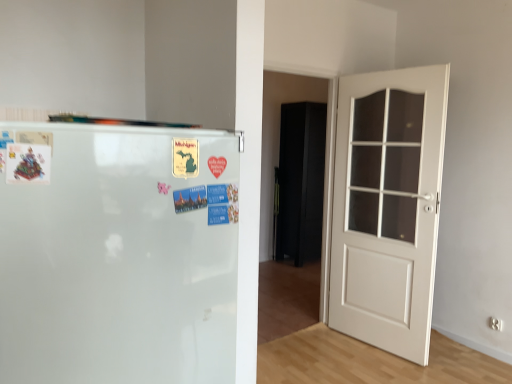
Question: Is the depth of white glossy refrigerator at left greater than that of white wooden door at right?

Choices:
 (A) yes
 (B) no

Answer: (B)

Question: Is white glossy refrigerator at left at the left side of white wooden door at right?

Choices:
 (A) no
 (B) yes

Answer: (B)

Question: From a real-world perspective, is white glossy refrigerator at left located higher than white wooden door at right?

Choices:
 (A) no
 (B) yes

Answer: (B)

Question: Does white glossy refrigerator at left come in front of white wooden door at right?

Choices:
 (A) yes
 (B) no

Answer: (A)

Question: Is white glossy refrigerator at left oriented towards white wooden door at right?

Choices:
 (A) yes
 (B) no

Answer: (B)

Question: Does point (409, 228) appear closer or farther from the camera than point (436, 74)?

Choices:
 (A) closer
 (B) farther

Answer: (B)

Question: From a real-world perspective, is clear glass door at right positioned above or below white wooden door at right?

Choices:
 (A) above
 (B) below

Answer: (A)

Question: Is clear glass door at right in front of or behind white wooden door at right in the image?

Choices:
 (A) behind
 (B) front

Answer: (A)

Question: In terms of height, does clear glass door at right look taller or shorter compared to white wooden door at right?

Choices:
 (A) tall
 (B) short

Answer: (B)

Question: From the image's perspective, relative to white wooden door at right, is white glossy refrigerator at left above or below?

Choices:
 (A) above
 (B) below

Answer: (B)

Question: In terms of width, does white glossy refrigerator at left look wider or thinner when compared to white wooden door at right?

Choices:
 (A) thin
 (B) wide

Answer: (B)

Question: From a real-world perspective, is white glossy refrigerator at left positioned above or below white wooden door at right?

Choices:
 (A) below
 (B) above

Answer: (B)

Question: Is white glossy refrigerator at left bigger or smaller than white wooden door at right?

Choices:
 (A) big
 (B) small

Answer: (A)

Question: Based on their positions, is white glossy refrigerator at left located to the left or right of black matte armoire at center?

Choices:
 (A) left
 (B) right

Answer: (A)

Question: From the image's perspective, relative to black matte armoire at center, is white glossy refrigerator at left above or below?

Choices:
 (A) below
 (B) above

Answer: (A)